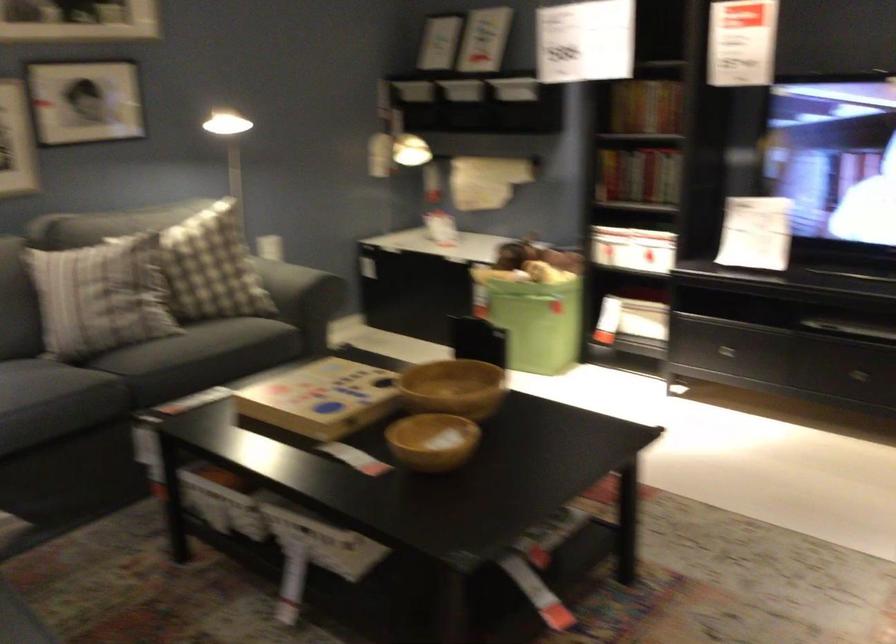
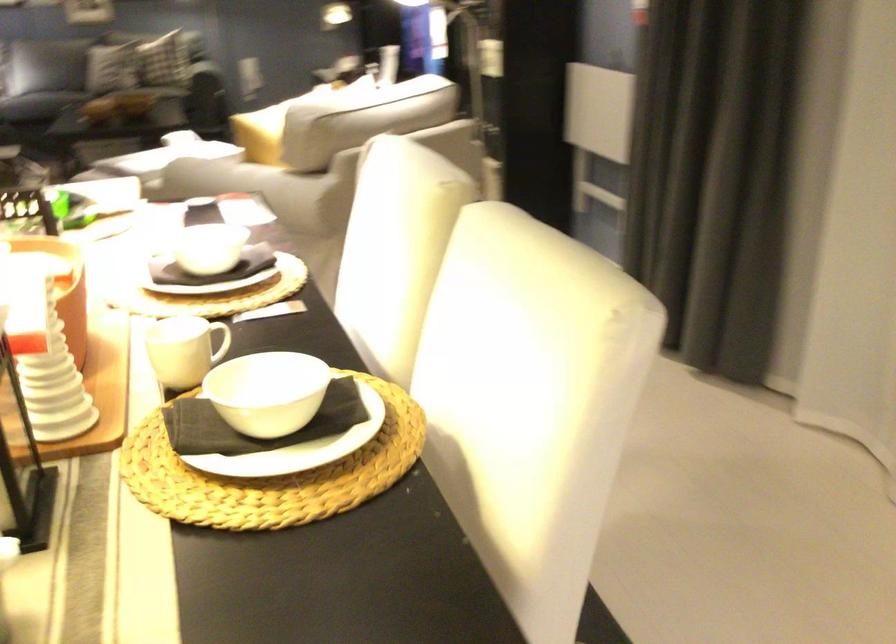
Question: I am providing you with two images of the same scene from different viewpoints. Which of the following objects are not visible in image2?

Choices:
 (A) dark napkin
 (B) wooden game box
 (C) Nutella jar
 (D) white bowl

Answer: (B)